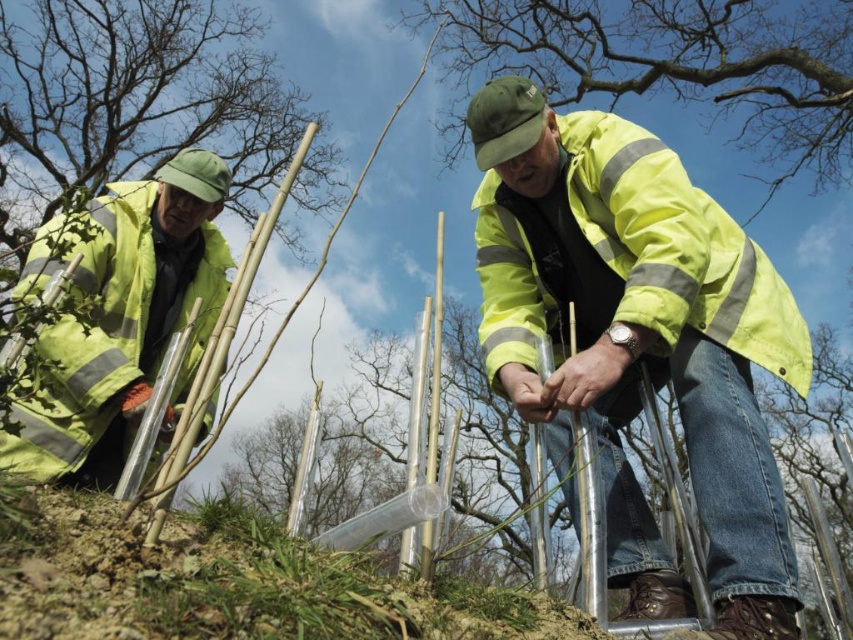
You are standing at the origin point of the coordinate system in the image. The yellow reflective jacket at center is at point 0.102, 0.797. If you want to move directly towards the jacket, which direction should you move in terms of x and y coordinates?

To move directly towards the yellow reflective jacket at center located at coordinates (679, 65) from the origin, you should move in the positive y direction since the y coordinate is higher than the x coordinate.